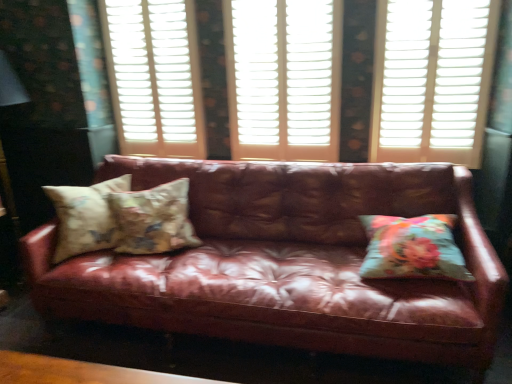
Question: Is leather couch at center to the right of white wood window frame at center, which ranks as the first window frame in right-to-left order, from the viewer's perspective?

Choices:
 (A) no
 (B) yes

Answer: (A)

Question: Can you confirm if leather couch at center is smaller than white wood window frame at center, the 2th window frame viewed from the left?

Choices:
 (A) no
 (B) yes

Answer: (A)

Question: Can you confirm if leather couch at center is thinner than white wood window frame at center, the 2th window frame viewed from the left?

Choices:
 (A) yes
 (B) no

Answer: (B)

Question: Are leather couch at center and white wood window frame at center, which ranks as the first window frame in right-to-left order, far apart?

Choices:
 (A) no
 (B) yes

Answer: (A)

Question: Could you tell me if leather couch at center is turned towards white wood window frame at center, which ranks as the first window frame in right-to-left order?

Choices:
 (A) no
 (B) yes

Answer: (A)

Question: Is white wood window frame at center, which ranks as the first window frame in right-to-left order, located within leather couch at center?

Choices:
 (A) no
 (B) yes

Answer: (A)

Question: From the image's perspective, is leather couch at center located beneath white plastic shutters at center, acting as the 1th window frame starting from the left?

Choices:
 (A) yes
 (B) no

Answer: (A)

Question: Is leather couch at center at the left side of white plastic shutters at center, which ranks as the 2th window frame in right-to-left order?

Choices:
 (A) no
 (B) yes

Answer: (A)

Question: From a real-world perspective, is leather couch at center on white plastic shutters at center, acting as the 1th window frame starting from the left?

Choices:
 (A) no
 (B) yes

Answer: (A)

Question: Is leather couch at center facing towards white plastic shutters at center, acting as the 1th window frame starting from the left?

Choices:
 (A) yes
 (B) no

Answer: (B)

Question: Is leather couch at center not within white plastic shutters at center, which ranks as the 2th window frame in right-to-left order?

Choices:
 (A) no
 (B) yes

Answer: (B)

Question: From the image's perspective, is leather couch at center over white plastic shutters at center, which ranks as the 2th window frame in right-to-left order?

Choices:
 (A) yes
 (B) no

Answer: (B)

Question: Does white plastic shutters at center, acting as the 1th window frame starting from the left, appear on the left side of white wood window frame at center, which ranks as the first window frame in right-to-left order?

Choices:
 (A) no
 (B) yes

Answer: (B)